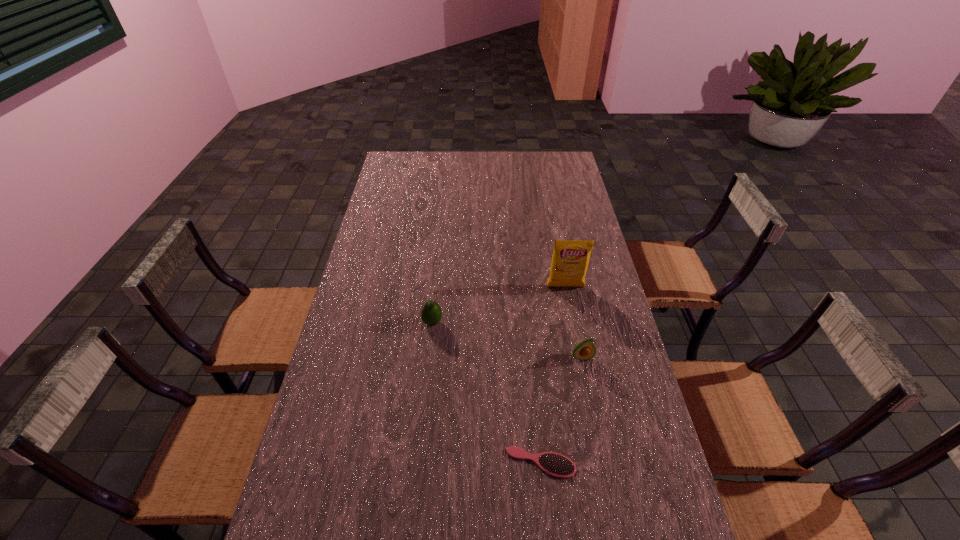
Image resolution: width=960 pixels, height=540 pixels. What are the coordinates of `vacant space situated on the cut side of the second nearest object` in the screenshot? It's located at (594, 419).

The image size is (960, 540). What are the coordinates of `free space located on the left of the nearest object` in the screenshot? It's located at (438, 462).

Locate an element on the screen. This screenshot has height=540, width=960. crisp (potato chip) at the right edge is located at coordinates (570, 259).

The width and height of the screenshot is (960, 540). In order to click on avocado that is at the right edge in this screenshot , I will do `click(585, 350)`.

The width and height of the screenshot is (960, 540). I want to click on vacant space at the far edge of the desktop, so 445,157.

Where is `free space at the left edge of the desktop`? This screenshot has width=960, height=540. free space at the left edge of the desktop is located at coordinates (406, 239).

The image size is (960, 540). Find the location of `blank space at the right edge of the desktop`. blank space at the right edge of the desktop is located at coordinates (658, 492).

The image size is (960, 540). What are the coordinates of `vacant space at the far left corner of the desktop` in the screenshot? It's located at (399, 166).

Find the location of `free space between the shortest object and the farther avocado`. free space between the shortest object and the farther avocado is located at coordinates (487, 393).

What are the coordinates of `blank region between the nearest object and the second nearest object` in the screenshot? It's located at (562, 410).